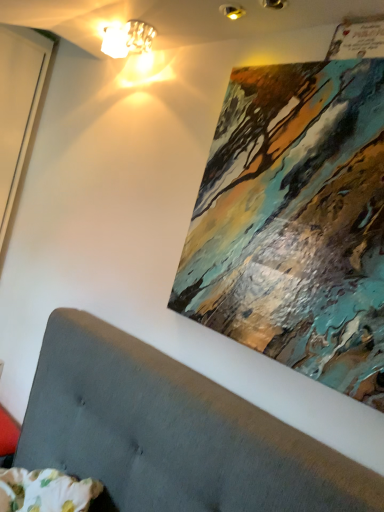
You are a GUI agent. You are given a task and a screenshot of the screen. Output one action in this format:
    pyautogui.click(x=<x>, y=<y>)
    Task: Click on the abstract painting at upper right
    
    Given the screenshot: What is the action you would take?
    pyautogui.click(x=297, y=217)

In order to face abstract painting at upper right, should I rotate leftwards or rightwards?

You should look right and rotate roughly 13.244 degrees.

The image size is (384, 512). What do you see at coordinates (297, 217) in the screenshot?
I see `abstract painting at upper right` at bounding box center [297, 217].

At what (x,y) coordinates should I click in order to perform the action: click on matte glass lampshade at upper center. Please return your answer as a coordinate pair (x, y). Looking at the image, I should click on pos(128,39).

In order to face matte glass lampshade at upper center, should I rotate leftwards or rightwards?

To face it directly, rotate left by 9.483 degrees.

This screenshot has width=384, height=512. Describe the element at coordinates (128, 39) in the screenshot. I see `matte glass lampshade at upper center` at that location.

The image size is (384, 512). In order to click on abstract painting at upper right in this screenshot , I will do `click(297, 217)`.

Considering the positions of objects matte glass lampshade at upper center and abstract painting at upper right in the image provided, who is more to the left, matte glass lampshade at upper center or abstract painting at upper right?

Positioned to the left is matte glass lampshade at upper center.

Which is in front, matte glass lampshade at upper center or abstract painting at upper right?

Positioned in front is abstract painting at upper right.

Between point (127, 47) and point (302, 168), which one is positioned behind?

The point (127, 47) is behind.

From the image's perspective, is matte glass lampshade at upper center beneath abstract painting at upper right?

Incorrect, from the image's perspective, matte glass lampshade at upper center is higher than abstract painting at upper right.

From a real-world perspective, is matte glass lampshade at upper center under abstract painting at upper right?

No, from a real-world perspective, matte glass lampshade at upper center is not under abstract painting at upper right.

Does matte glass lampshade at upper center have a lesser width compared to abstract painting at upper right?

Incorrect, the width of matte glass lampshade at upper center is not less than that of abstract painting at upper right.

Does matte glass lampshade at upper center have a lesser height compared to abstract painting at upper right?

Yes, matte glass lampshade at upper center is shorter than abstract painting at upper right.

Can you confirm if matte glass lampshade at upper center is bigger than abstract painting at upper right?

Actually, matte glass lampshade at upper center might be smaller than abstract painting at upper right.

Which is correct: matte glass lampshade at upper center is inside abstract painting at upper right, or outside of it?

matte glass lampshade at upper center exists outside the volume of abstract painting at upper right.

Are matte glass lampshade at upper center and abstract painting at upper right far apart?

matte glass lampshade at upper center is actually quite close to abstract painting at upper right.

Is matte glass lampshade at upper center facing away from abstract painting at upper right?

No.

How many degrees apart are the facing directions of matte glass lampshade at upper center and abstract painting at upper right?

8.61 degrees separate the facing orientations of matte glass lampshade at upper center and abstract painting at upper right.

How much distance is there between matte glass lampshade at upper center and abstract painting at upper right?

matte glass lampshade at upper center is 35.05 inches from abstract painting at upper right.

At what (x,y) coordinates should I click in order to perform the action: click on lamp positioned vertically above the abstract painting at upper right (from a real-world perspective). Please return your answer as a coordinate pair (x, y). Looking at the image, I should click on (128, 39).

Looking at this image, which is more to the right, abstract painting at upper right or matte glass lampshade at upper center?

abstract painting at upper right is more to the right.

Considering the positions of objects abstract painting at upper right and matte glass lampshade at upper center in the image provided, who is in front, abstract painting at upper right or matte glass lampshade at upper center?

abstract painting at upper right is in front.

Does point (234, 191) lie behind point (105, 51)?

That is False.

From the image's perspective, is abstract painting at upper right located above or below matte glass lampshade at upper center?

From the image's perspective, abstract painting at upper right appears below matte glass lampshade at upper center.

From a real-world perspective, which is physically above, abstract painting at upper right or matte glass lampshade at upper center?

In real-world perspective, matte glass lampshade at upper center is above.

Can you confirm if abstract painting at upper right is thinner than matte glass lampshade at upper center?

Correct, the width of abstract painting at upper right is less than that of matte glass lampshade at upper center.

Considering the sizes of objects abstract painting at upper right and matte glass lampshade at upper center in the image provided, who is shorter, abstract painting at upper right or matte glass lampshade at upper center?

matte glass lampshade at upper center.

Based on their sizes in the image, would you say abstract painting at upper right is bigger or smaller than matte glass lampshade at upper center?

Clearly, abstract painting at upper right is larger in size than matte glass lampshade at upper center.

Based on the photo, would you say abstract painting at upper right is inside or outside matte glass lampshade at upper center?

abstract painting at upper right lies outside matte glass lampshade at upper center.

Is abstract painting at upper right far from matte glass lampshade at upper center?

They are positioned close to each other.

Is abstract painting at upper right aimed at matte glass lampshade at upper center?

No.

Where is `lamp behind the abstract painting at upper right`? The width and height of the screenshot is (384, 512). lamp behind the abstract painting at upper right is located at coordinates [128, 39].

Locate an element on the screen. The height and width of the screenshot is (512, 384). picture frame to the right of matte glass lampshade at upper center is located at coordinates pos(297,217).

This screenshot has width=384, height=512. Identify the location of lamp above the abstract painting at upper right (from the image's perspective). (128, 39).